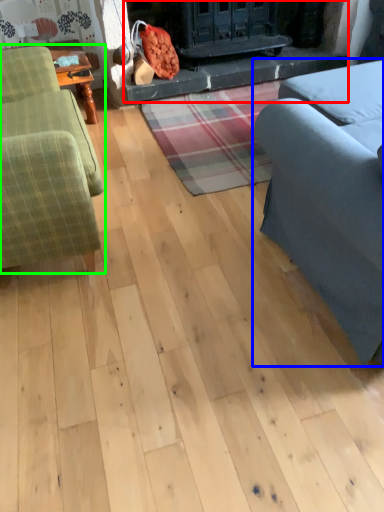
Question: Estimate the real-world distances between objects in this image. Which object is closer to fireplace (highlighted by a red box), studio couch (highlighted by a blue box) or studio couch (highlighted by a green box)?

Choices:
 (A) studio couch
 (B) studio couch

Answer: (B)